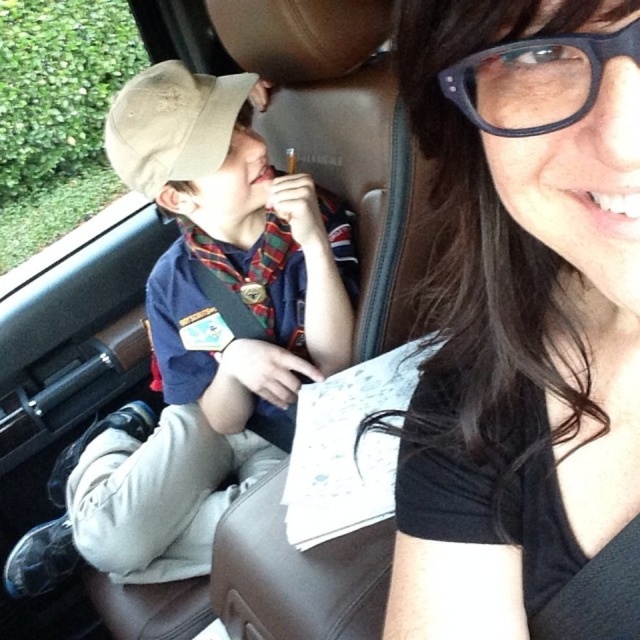
Can you confirm if matte khaki cap at left is positioned above black plastic glasses at upper right?

Incorrect, matte khaki cap at left is not positioned above black plastic glasses at upper right.

Based on the photo, is matte khaki cap at left to the left of black plastic glasses at upper right from the viewer's perspective?

Yes, matte khaki cap at left is to the left of black plastic glasses at upper right.

Is point (188, 548) positioned behind point (536, 125)?

Yes.

What are the coordinates of `matte khaki cap at left` in the screenshot? It's located at (204, 332).

Which is more to the left, matte khaki cap at left or tan fabric baseball cap at left?

matte khaki cap at left

Does matte khaki cap at left have a greater height compared to tan fabric baseball cap at left?

Correct, matte khaki cap at left is much taller as tan fabric baseball cap at left.

This screenshot has width=640, height=640. What do you see at coordinates (204, 332) in the screenshot? I see `matte khaki cap at left` at bounding box center [204, 332].

At what (x,y) coordinates should I click in order to perform the action: click on matte khaki cap at left. Please return your answer as a coordinate pair (x, y). Looking at the image, I should click on (204, 332).

Does black matte glasses at upper right have a greater height compared to matte khaki cap at left?

Incorrect, black matte glasses at upper right's height is not larger of matte khaki cap at left's.

Which of these two, black matte glasses at upper right or matte khaki cap at left, stands taller?

With more height is matte khaki cap at left.

Who is more distant from viewer, (563, 227) or (248, 275)?

Point (248, 275)

Identify the location of black matte glasses at upper right. (522, 308).